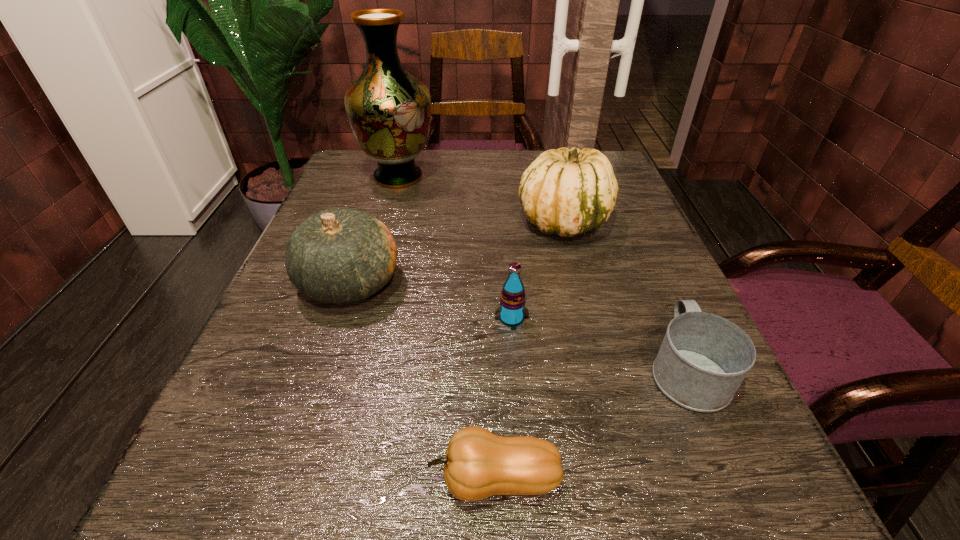
The image size is (960, 540). In order to click on the tallest object in this screenshot , I will do `click(389, 110)`.

Locate an element on the screen. The image size is (960, 540). the farthest gourd is located at coordinates (567, 192).

I want to click on the leftmost gourd, so click(x=340, y=256).

Locate an element on the screen. This screenshot has width=960, height=540. the third shortest object is located at coordinates (512, 311).

The image size is (960, 540). What are the coordinates of `mug` in the screenshot? It's located at (703, 359).

Locate an element on the screen. The width and height of the screenshot is (960, 540). the nearest gourd is located at coordinates (478, 464).

I want to click on the shortest gourd, so click(x=478, y=464).

Identify the location of blank space located 0.380m on the front of the tallest object. This screenshot has height=540, width=960. (357, 320).

Locate an element on the screen. This screenshot has width=960, height=540. vacant area situated 0.390m on the front of the farthest gourd is located at coordinates (620, 442).

Where is `vacant space situated on the front of the leftmost gourd`? This screenshot has height=540, width=960. vacant space situated on the front of the leftmost gourd is located at coordinates (288, 467).